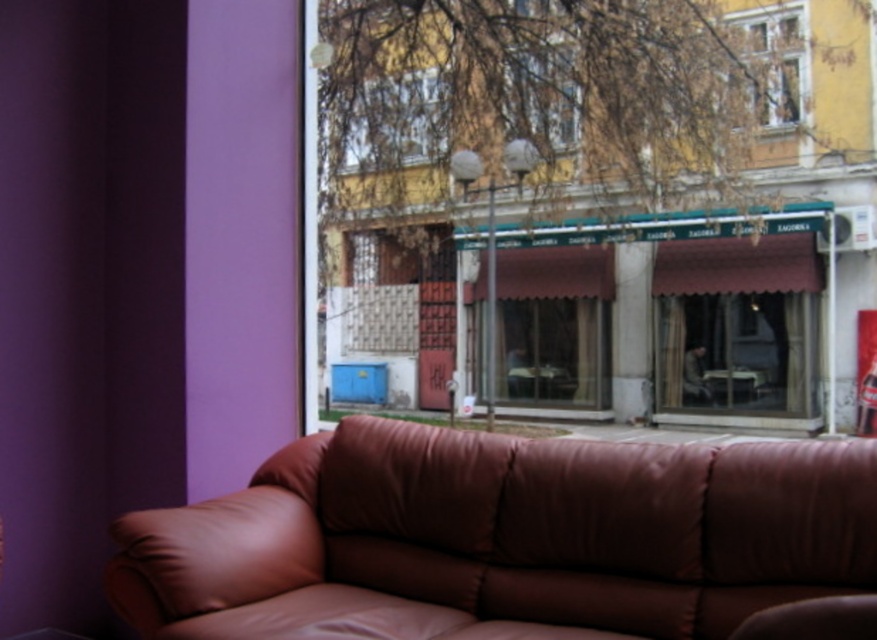
Is leather couch at lower center positioned in front of transparent glass window at center?

Yes.

Who is more distant from viewer, (774,456) or (539,106)?

The point (539,106) is behind.

Is point (651, 605) more distant than point (560, 70)?

No.

Where is `leather couch at lower center`? The height and width of the screenshot is (640, 877). leather couch at lower center is located at coordinates (501, 538).

Which of these two, transparent glass window at upper center or wooden window frame at upper right, stands shorter?

With less height is transparent glass window at upper center.

Where is `transparent glass window at upper center`? Image resolution: width=877 pixels, height=640 pixels. transparent glass window at upper center is located at coordinates (391, 122).

Is point (419, 74) positioned after point (797, 61)?

No, (419, 74) is closer to viewer.

This screenshot has height=640, width=877. I want to click on transparent glass window at upper center, so click(391, 122).

Who is lower down, leather couch at lower center or transparent glass window at upper center?

leather couch at lower center is below.

Which is above, leather couch at lower center or transparent glass window at upper center?

transparent glass window at upper center is above.

Between point (579, 547) and point (325, 90), which one is positioned in front?

Positioned in front is point (579, 547).

Image resolution: width=877 pixels, height=640 pixels. Identify the location of leather couch at lower center. (501, 538).